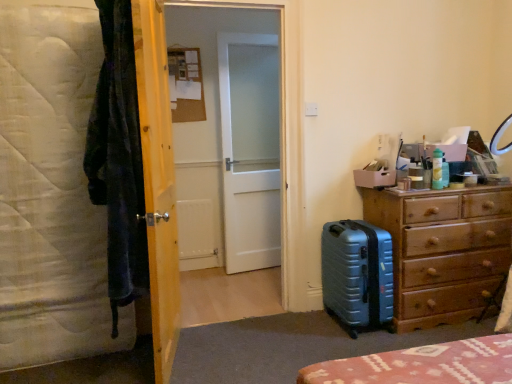
The height and width of the screenshot is (384, 512). What are the coordinates of `vacant area situated to the left side of metallic blue suitcase at lower right` in the screenshot? It's located at (301, 325).